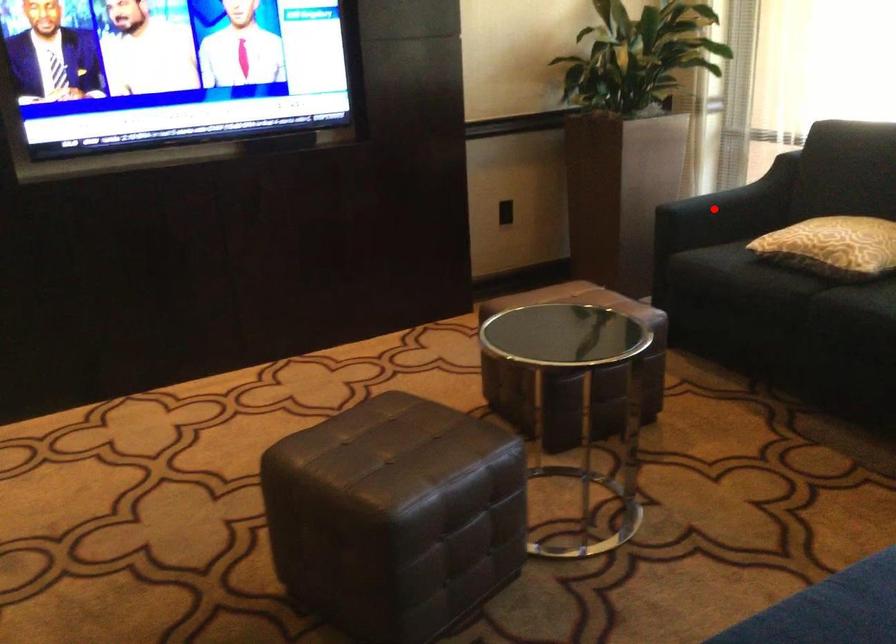
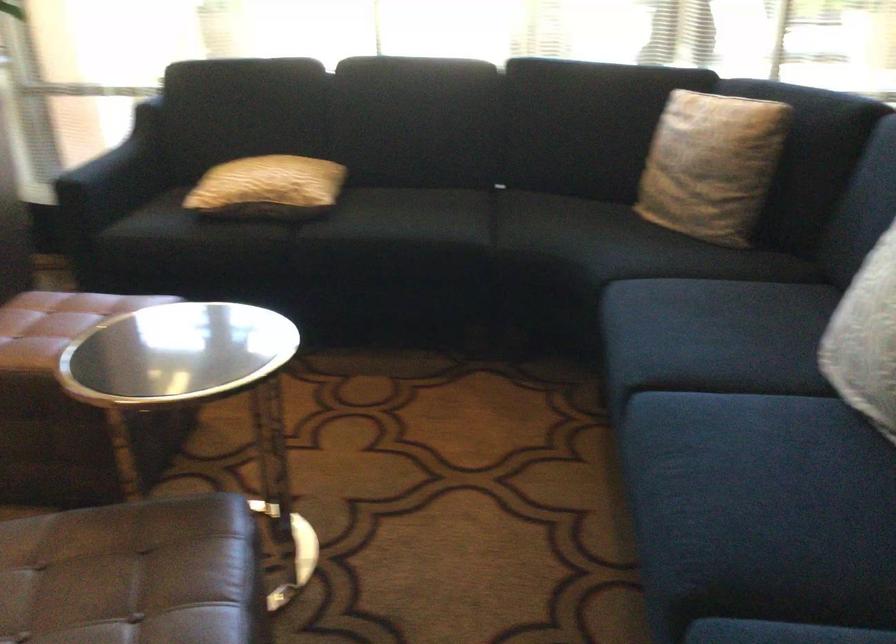
Where in the second image is the point corresponding to the highlighted location from the first image?

(115, 176)